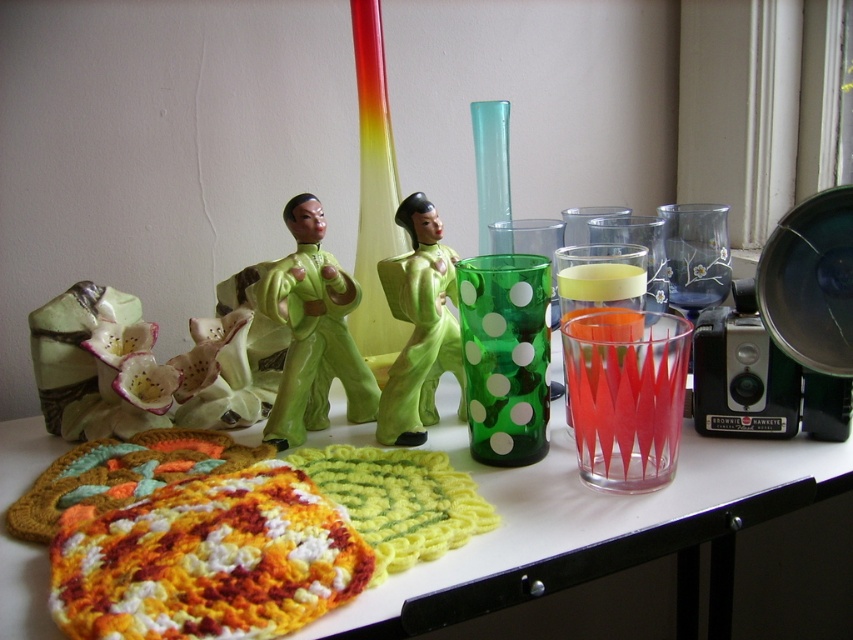
Question: Which object is the farthest from the green glossy figurine at center?

Choices:
 (A) green matte figure at center
 (B) translucent red glass at center right
 (C) knitted fabric placemat at center

Answer: (B)

Question: Does knitted fabric placemat at center appear on the left side of translucent red glass at center right?

Choices:
 (A) no
 (B) yes

Answer: (B)

Question: Does translucent red glass at center right have a smaller size compared to green matte figure at center?

Choices:
 (A) yes
 (B) no

Answer: (A)

Question: Does green matte figure at center have a greater width compared to green glossy figurine at center?

Choices:
 (A) no
 (B) yes

Answer: (B)

Question: Which point is farther to the camera?

Choices:
 (A) (775, 440)
 (B) (412, 220)
 (C) (596, 324)
 (D) (317, 250)

Answer: (D)

Question: Which point is farther from the camera taking this photo?

Choices:
 (A) (306, 218)
 (B) (432, 220)

Answer: (B)